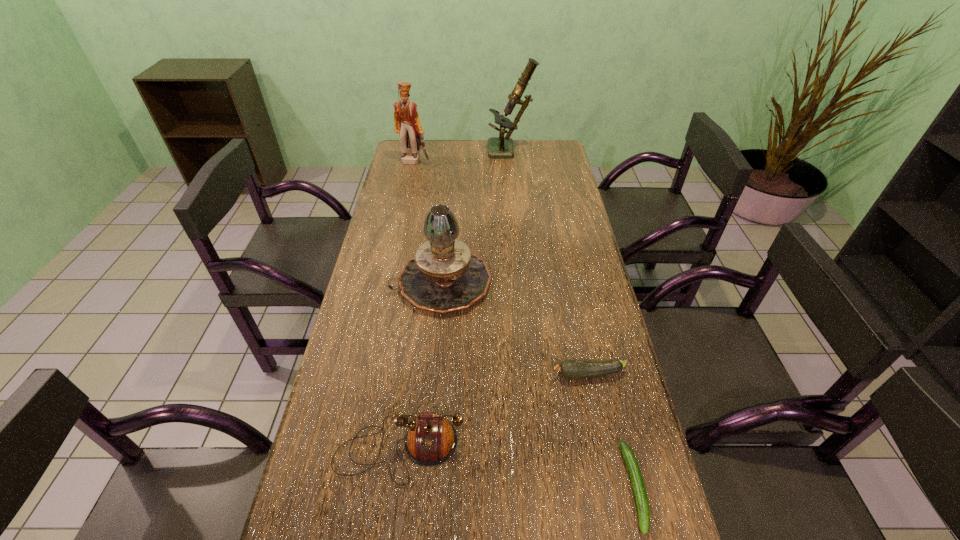
What are the coordinates of `vacant space located 0.200m at the eyepiece of the microscope` in the screenshot? It's located at (443, 152).

What are the coordinates of `blank area located at the eyepiece of the microscope` in the screenshot? It's located at point(409,152).

Where is `free space located 0.320m on the front-facing side of the nutcracker`? free space located 0.320m on the front-facing side of the nutcracker is located at coordinates (405, 212).

Identify the location of vacant area situated on the front of the fourth nearest object. (435, 353).

Identify the location of vacant space situated on the rotary dial of the telephone. Image resolution: width=960 pixels, height=540 pixels. (x=391, y=518).

Find the location of `vacant position located at the blossom end of the fourth farthest object`. vacant position located at the blossom end of the fourth farthest object is located at coordinates (397, 375).

Find the location of a particular element. This screenshot has height=540, width=960. free space located 0.260m at the blossom end of the fourth farthest object is located at coordinates (449, 375).

I want to click on vacant region located 0.100m at the blossom end of the fourth farthest object, so click(x=512, y=375).

Locate an element on the screen. microscope that is at the far edge is located at coordinates (498, 147).

You are a GUI agent. You are given a task and a screenshot of the screen. Output one action in this format:
    pyautogui.click(x=<x>, y=<y>)
    Task: Click on the nutcracker positioned at the far edge
    
    Given the screenshot: What is the action you would take?
    pyautogui.click(x=407, y=124)